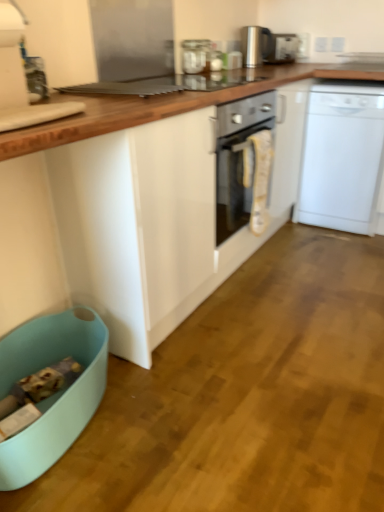
Question: Is light blue plastic dish washer at lower left to the left or to the right of white glossy cabinet at center in the image?

Choices:
 (A) left
 (B) right

Answer: (A)

Question: From a real-world perspective, is light blue plastic dish washer at lower left physically located above or below white glossy cabinet at center?

Choices:
 (A) below
 (B) above

Answer: (A)

Question: Which object is positioned farthest from the white glossy cabinet at center?

Choices:
 (A) clear glass jar at upper center, the 1th kitchen appliance viewed from the left
 (B) polished stainless steel kettle at upper center, which appears as the first kitchen appliance when viewed from the top
 (C) light blue plastic dish washer at lower left
 (D) white plastic dishwasher at right
 (E) satin silver toaster at upper center

Answer: (E)

Question: Considering the real-world distances, which object is closest to the white plastic dishwasher at right?

Choices:
 (A) satin silver toaster at upper center
 (B) polished stainless steel kettle at upper center, which appears as the first kitchen appliance when viewed from the top
 (C) white glossy cabinet at center
 (D) clear glass jar at upper center, the first kitchen appliance when ordered from bottom to top
 (E) light blue plastic dish washer at lower left

Answer: (C)